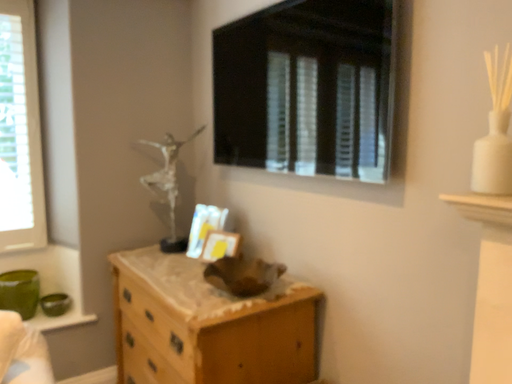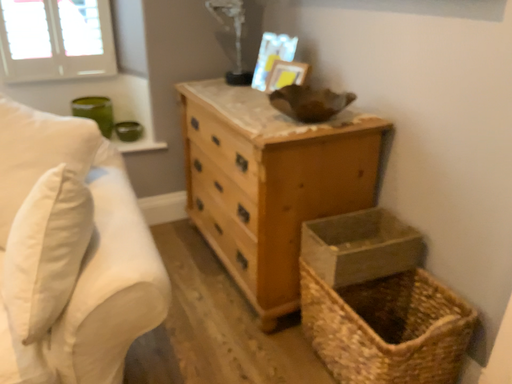
Question: How did the camera likely rotate when shooting the video?

Choices:
 (A) rotated left
 (B) rotated right

Answer: (A)